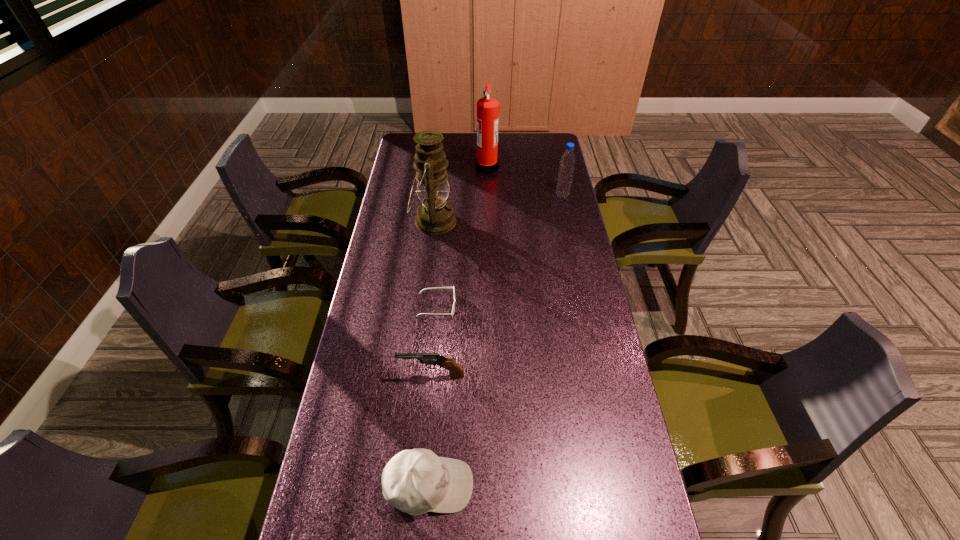
Locate an element on the screen. vacant area situated 0.100m with the nozzle aimed from the farthest object is located at coordinates (453, 167).

Where is `free space located on the back of the oil lamp`? free space located on the back of the oil lamp is located at coordinates (438, 187).

Locate an element on the screen. The height and width of the screenshot is (540, 960). vacant space located on the front of the rightmost object is located at coordinates (569, 226).

Image resolution: width=960 pixels, height=540 pixels. I want to click on vacant space located 0.130m along the barrel of the gun, so click(x=353, y=376).

You are a GUI agent. You are given a task and a screenshot of the screen. Output one action in this format:
    pyautogui.click(x=<x>, y=<y>)
    Task: Click on the vacant region located 0.070m along the barrel of the gun
    This screenshot has height=540, width=960.
    Given the screenshot: What is the action you would take?
    pyautogui.click(x=374, y=376)

I want to click on free location located along the barrel of the gun, so click(x=378, y=376).

I want to click on free spot located 0.370m on the front-facing side of the baseball cap, so click(632, 486).

The height and width of the screenshot is (540, 960). I want to click on vacant space located 0.320m with the lenses of the sunglasses facing outward, so click(x=556, y=306).

The height and width of the screenshot is (540, 960). Identify the location of object present at the far edge. (488, 108).

Where is `oil lamp that is at the left edge`? The height and width of the screenshot is (540, 960). oil lamp that is at the left edge is located at coordinates (435, 216).